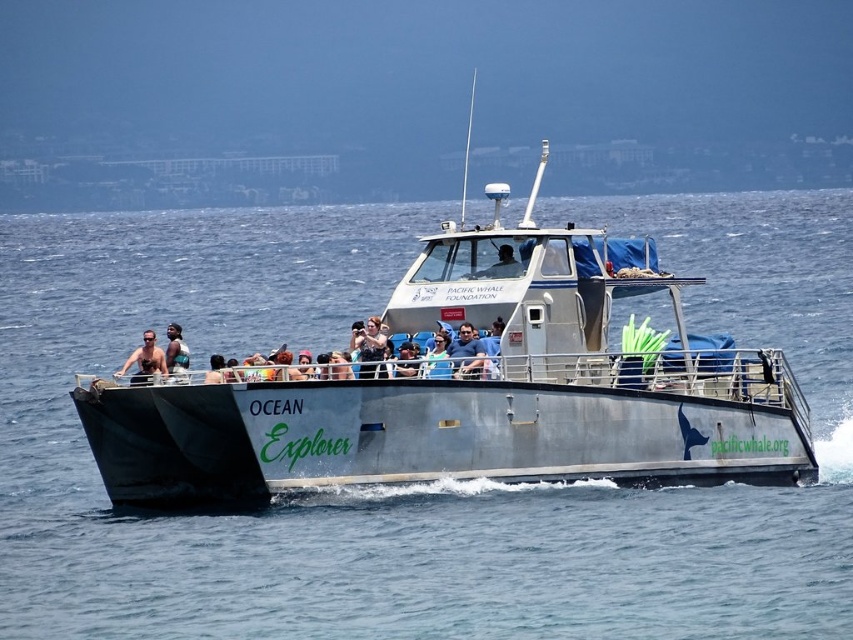
You are standing on the deck of the metallic gray boat at center. You want to toss a lifebuoy to someone wearing the matte black shirt at center. If the lifebuoy can travel 20 meters, will it reach them?

The metallic gray boat at center is 19.12 meters from the matte black shirt at center. Since the lifebuoy can travel 20 meters, it will reach them.

You are a photographer on the Ocean Explorer boat and need to capture both the blue fabric shirt at center and the matte black shirt at center in your shot. Which shirt should you focus on to ensure both are visible without zooming in too much?

The blue fabric shirt at center occupies less space than the matte black shirt at center, so focusing on the matte black shirt at center would allow both shirts to be visible without excessive zooming since it takes up more space.

You are standing on the deck of the Ocean Explorer boat and see two points marked on the deck. The first point is at coordinate point (457, 340) and the second is at point (137, 369). If you want to move from the first point to the second point, in which direction should you move relative to the boat?

Since point (457, 340) is closer to the camera than point (137, 369), you should move towards the stern of the boat to reach the second point.